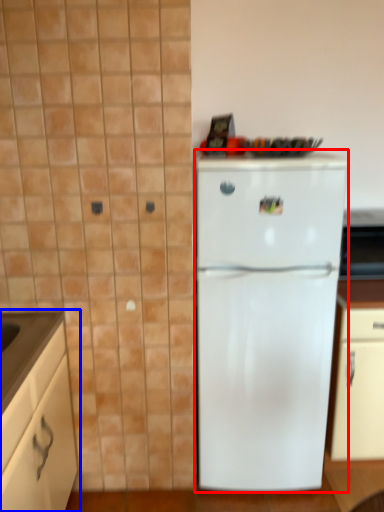
Question: Among these objects, which one is nearest to the camera, refrigerator (highlighted by a red box) or cabinetry (highlighted by a blue box)?

Choices:
 (A) refrigerator
 (B) cabinetry

Answer: (B)